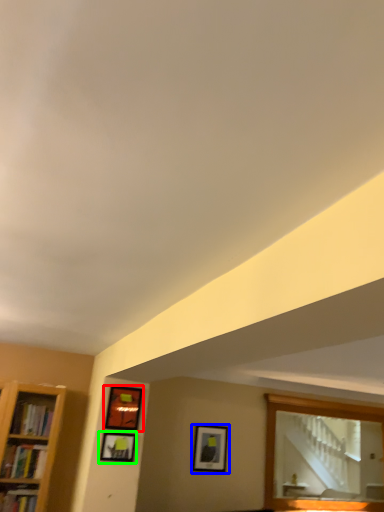
Question: Which object is positioned closest to picture frame (highlighted by a red box)? Select from picture frame (highlighted by a blue box) and picture frame (highlighted by a green box).

Choices:
 (A) picture frame
 (B) picture frame

Answer: (B)